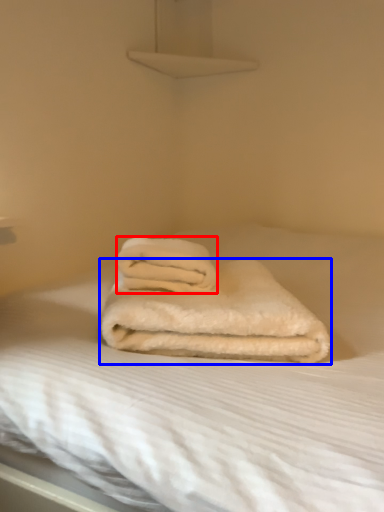
Question: Which of the following is the closest to the observer, towel (highlighted by a red box) or towel (highlighted by a blue box)?

Choices:
 (A) towel
 (B) towel

Answer: (B)